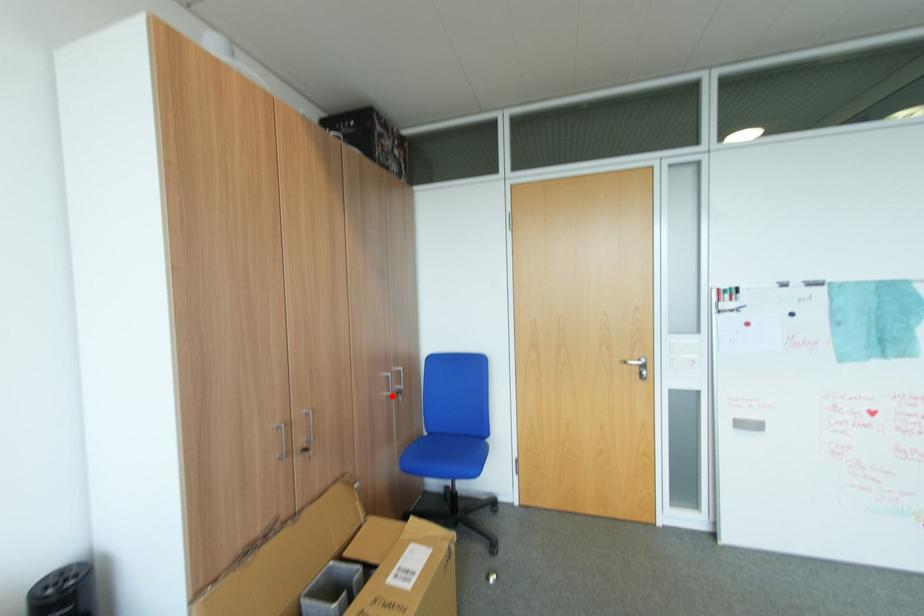
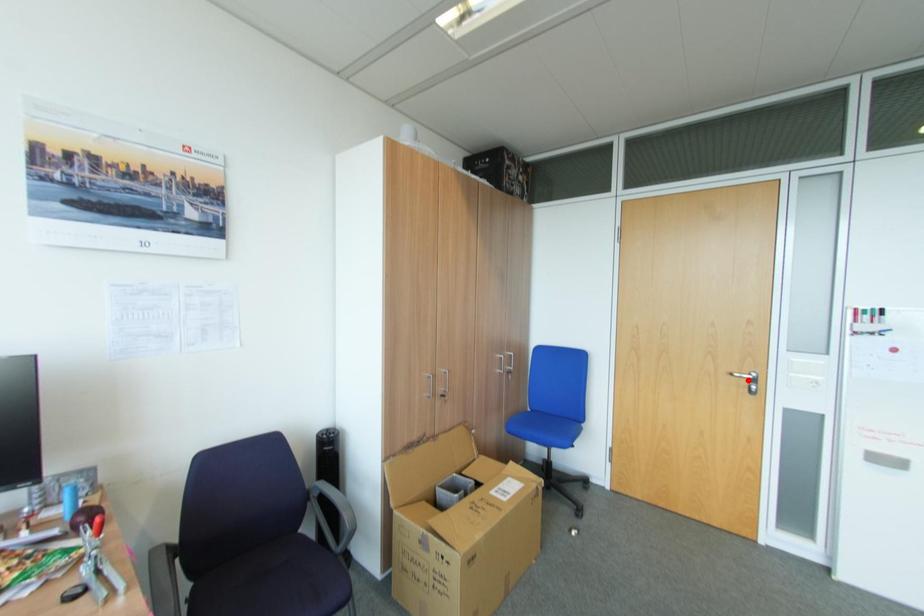
I am providing you with two images of the same scene from different viewpoints. A red point is marked on the first image and another point is marked on the second image. Is the red point in image1 aligned with the point shown in image2?

No